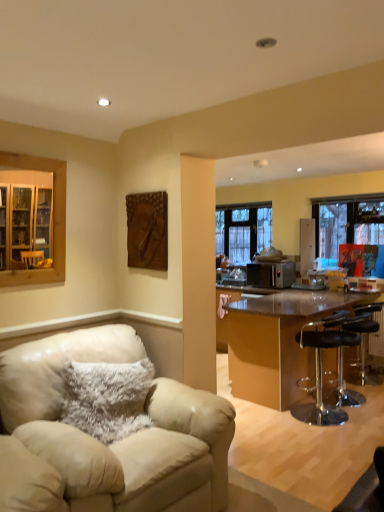
This screenshot has width=384, height=512. What do you see at coordinates (147, 230) in the screenshot?
I see `wooden carving at upper center` at bounding box center [147, 230].

At what (x,y) coordinates should I click in order to perform the action: click on wooden cabinet at left. Please return your answer as a coordinate pair (x, y). Looking at the image, I should click on (30, 225).

This screenshot has width=384, height=512. Describe the element at coordinates (30, 225) in the screenshot. I see `wooden cabinet at left` at that location.

Image resolution: width=384 pixels, height=512 pixels. Identify the location of beige leather chair at lower left, placed as the fourth chair when sorted from back to front. (101, 442).

What do you see at coordinates (101, 442) in the screenshot? I see `beige leather chair at lower left, placed as the fourth chair when sorted from back to front` at bounding box center [101, 442].

Find the location of a particular element. The width and height of the screenshot is (384, 512). transparent glass window at right, acting as the 2th window starting from the left is located at coordinates [x=352, y=233].

I want to click on wooden carving at upper center, so click(147, 230).

Is black leather bar stool at right, positioned as the third chair in right-to-left order, spatially inside wooden carving at upper center, or outside of it?

The correct answer is: outside.

Which is closer, (316, 399) or (153, 243)?

The point (153, 243) is in front.

Between black leather bar stool at right, positioned as the third chair in right-to-left order, and wooden carving at upper center, which one has larger width?

black leather bar stool at right, positioned as the third chair in right-to-left order, is wider.

Is the depth of black leather bar stool at right, the second chair in the left-to-right sequence, less than that of transparent glass window at right, arranged as the first window when viewed from the front?

Yes, black leather bar stool at right, the second chair in the left-to-right sequence, is in front of transparent glass window at right, arranged as the first window when viewed from the front.

Does point (305, 344) come behind point (355, 198)?

No, it is in front of (355, 198).

Could you tell me if black leather bar stool at right, which ranks as the second chair in front-to-back order, is facing transparent glass window at right, which is the 1th window from right to left?

No, black leather bar stool at right, which ranks as the second chair in front-to-back order, is not oriented towards transparent glass window at right, which is the 1th window from right to left.

From the image's perspective, is black leather bar stool at right, positioned as the third chair in right-to-left order, positioned above or below transparent glass window at right, acting as the 2th window starting from the left?

Clearly, from the image's perspective, black leather bar stool at right, positioned as the third chair in right-to-left order, is below transparent glass window at right, acting as the 2th window starting from the left.

Is wooden carving at upper center at the left side of shiny brown table at right?

Correct, you'll find wooden carving at upper center to the left of shiny brown table at right.

Are wooden carving at upper center and shiny brown table at right located far from each other?

wooden carving at upper center is positioned a significant distance from shiny brown table at right.

From a real-world perspective, is wooden carving at upper center located higher than shiny brown table at right?

Correct, in the physical world, wooden carving at upper center is higher than shiny brown table at right.

Based on the photo, which is nearer, [156,214] or [310,380]?

The point [156,214] is more forward.

From a real-world perspective, is black leather bar stool at right, which ranks as the second chair in front-to-back order, above or below transparent plastic bar stool at right, marked as the 3th chair in a left-to-right arrangement?

In terms of real-world spatial position, black leather bar stool at right, which ranks as the second chair in front-to-back order, is above transparent plastic bar stool at right, marked as the 3th chair in a left-to-right arrangement.

Would you say black leather bar stool at right, positioned as the third chair in right-to-left order, is inside or outside transparent plastic bar stool at right, marked as the 3th chair in a left-to-right arrangement?

black leather bar stool at right, positioned as the third chair in right-to-left order, is not inside transparent plastic bar stool at right, marked as the 3th chair in a left-to-right arrangement, it's outside.

Is black leather bar stool at right, the second chair in the left-to-right sequence, bigger or smaller than transparent plastic bar stool at right, which ranks as the 3th chair in front-to-back order?

In the image, black leather bar stool at right, the second chair in the left-to-right sequence, appears to be larger than transparent plastic bar stool at right, which ranks as the 3th chair in front-to-back order.

Are black leather bar stool at right, the second chair in the left-to-right sequence, and transparent plastic bar stool at right, marked as the 3th chair in a left-to-right arrangement, located far from each other?

No, black leather bar stool at right, the second chair in the left-to-right sequence, is not far from transparent plastic bar stool at right, marked as the 3th chair in a left-to-right arrangement.

Considering the sizes of objects black leather bar stool at right, which is the fourth chair in front-to-back order, and wooden cabinet at left in the image provided, who is thinner, black leather bar stool at right, which is the fourth chair in front-to-back order, or wooden cabinet at left?

wooden cabinet at left is thinner.

In the scene shown: Considering the relative positions of black leather bar stool at right, which ranks as the 4th chair in left-to-right order, and wooden cabinet at left in the image provided, is black leather bar stool at right, which ranks as the 4th chair in left-to-right order, to the left of wooden cabinet at left from the viewer's perspective?

No.

Is there a large distance between black leather bar stool at right, which is the fourth chair in front-to-back order, and wooden cabinet at left?

Indeed, black leather bar stool at right, which is the fourth chair in front-to-back order, is not near wooden cabinet at left.

In the scene shown: Can you confirm if black leather bar stool at right, marked as the first chair in a back-to-front arrangement, is bigger than wooden cabinet at left?

Indeed, black leather bar stool at right, marked as the first chair in a back-to-front arrangement, has a larger size compared to wooden cabinet at left.

Which is behind, transparent plastic bar stool at right, which appears as the 2th chair when viewed from the right, or satin silver toaster at center?

satin silver toaster at center is further away from the camera.

Considering the positions of objects transparent plastic bar stool at right, marked as the 3th chair in a left-to-right arrangement, and satin silver toaster at center in the image provided, who is more to the left, transparent plastic bar stool at right, marked as the 3th chair in a left-to-right arrangement, or satin silver toaster at center?

satin silver toaster at center.

Locate an element on the screen. The width and height of the screenshot is (384, 512). appliance above the transparent plastic bar stool at right, which ranks as the 3th chair in front-to-back order (from the image's perspective) is located at coordinates (271, 274).

Consider the image. Can you tell me how much satin silver toaster at center and beige leather chair at lower left, the 1th chair in the left-to-right sequence, differ in facing direction?

They differ by 94 degrees in their facing directions.

From a real-world perspective, who is located higher, satin silver toaster at center or beige leather chair at lower left, the first chair from the front?

In real-world perspective, satin silver toaster at center is above.

Can you confirm if satin silver toaster at center is shorter than beige leather chair at lower left, placed as the fourth chair when sorted from back to front?

Yes.

Is satin silver toaster at center far from beige leather chair at lower left, which ranks as the fourth chair in right-to-left order?

Indeed, satin silver toaster at center is not near beige leather chair at lower left, which ranks as the fourth chair in right-to-left order.

The image size is (384, 512). I want to click on picture frame that is above the black leather bar stool at right, the second chair in the left-to-right sequence (from the image's perspective), so click(147, 230).

Where is `window located on the right of black leather bar stool at right, the 3th chair from the back`? window located on the right of black leather bar stool at right, the 3th chair from the back is located at coordinates (352, 233).

Considering their positions, is black leather bar stool at right, the 1th chair from the right, positioned further to fuzzy beige pillow at lower left than satin silver toaster at center?

The object further to fuzzy beige pillow at lower left is satin silver toaster at center.

Based on their spatial positions, is wooden carving at upper center or black leather bar stool at right, the 1th chair from the right, closer to clear glass window at center, acting as the first window starting from the left?

black leather bar stool at right, the 1th chair from the right, lies closer to clear glass window at center, acting as the first window starting from the left, than the other object.

From the image, which object appears to be nearer to black leather bar stool at right, the 3th chair from the back, shiny brown table at right or beige leather chair at lower left, which ranks as the fourth chair in right-to-left order?

Based on the image, shiny brown table at right appears to be nearer to black leather bar stool at right, the 3th chair from the back.

Looking at the image, which one is located further to black leather bar stool at right, the second chair in the left-to-right sequence, transparent plastic bar stool at right, which appears as the 2th chair when viewed from the right, or transparent glass window at right, the 2th window in the back-to-front sequence?

transparent glass window at right, the 2th window in the back-to-front sequence, lies further to black leather bar stool at right, the second chair in the left-to-right sequence, than the other object.

Based on their spatial positions, is transparent plastic bar stool at right, which appears as the 2th chair when viewed from the right, or clear glass window at center, positioned as the second window in right-to-left order, further from black leather bar stool at right, the 3th chair from the back?

The object further to black leather bar stool at right, the 3th chair from the back, is clear glass window at center, positioned as the second window in right-to-left order.

Which object lies nearer to the anchor point wooden cabinet at left, satin silver toaster at center or fuzzy beige pillow at lower left?

fuzzy beige pillow at lower left is positioned closer to the anchor wooden cabinet at left.

Which object lies further to the anchor point black leather bar stool at right, positioned as the third chair in right-to-left order, clear glass window at center, the 1th window positioned from the back, or satin silver toaster at center?

clear glass window at center, the 1th window positioned from the back, is further to black leather bar stool at right, positioned as the third chair in right-to-left order.

Based on their spatial positions, is black leather bar stool at right, the 1th chair from the right, or wooden carving at upper center closer to black leather bar stool at right, the 3th chair from the back?

Based on the image, black leather bar stool at right, the 1th chair from the right, appears to be nearer to black leather bar stool at right, the 3th chair from the back.

Locate an element on the screen. This screenshot has width=384, height=512. chair located between black leather bar stool at right, which ranks as the second chair in front-to-back order, and black leather bar stool at right, the 1th chair from the right, in the depth direction is located at coordinates (342, 366).

The image size is (384, 512). I want to click on picture frame positioned between wooden cabinet at left and satin silver toaster at center from near to far, so click(147, 230).

Locate an element on the screen. The height and width of the screenshot is (512, 384). kitchen & dining room table located between wooden carving at upper center and black leather bar stool at right, marked as the first chair in a back-to-front arrangement, in the left-right direction is located at coordinates (277, 343).

Where is `picture frame located between beige leather chair at lower left, which ranks as the fourth chair in right-to-left order, and transparent glass window at right, the 2th window in the back-to-front sequence, in the depth direction`? This screenshot has width=384, height=512. picture frame located between beige leather chair at lower left, which ranks as the fourth chair in right-to-left order, and transparent glass window at right, the 2th window in the back-to-front sequence, in the depth direction is located at coordinates (147, 230).